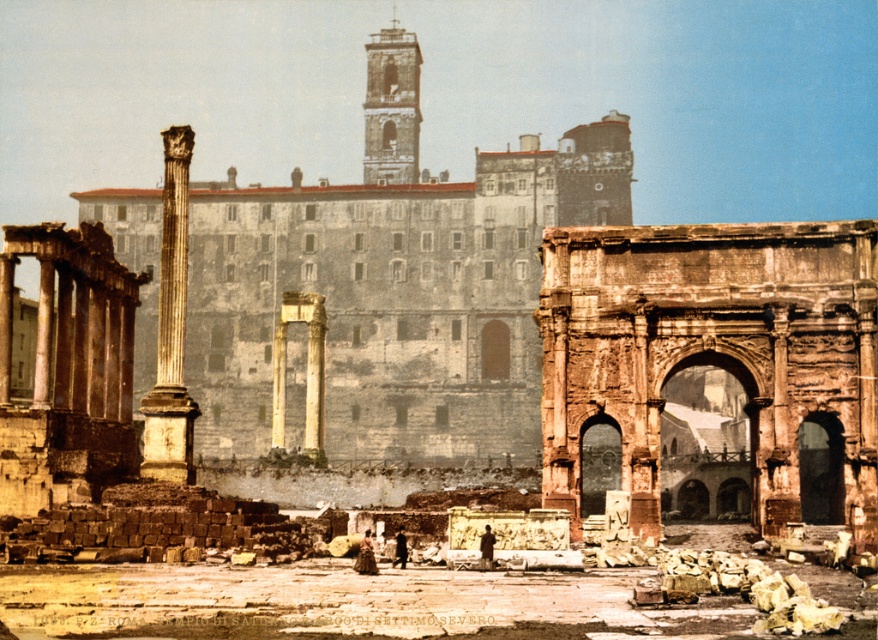
What do you see at coordinates (171, 328) in the screenshot? This screenshot has height=640, width=878. I see `yellowish stone column at left` at bounding box center [171, 328].

Is yellowish stone column at left thinner than smooth stone column at center?

Incorrect, yellowish stone column at left's width is not less than smooth stone column at center's.

At what (x,y) coordinates should I click in order to perform the action: click on yellowish stone column at left. Please return your answer as a coordinate pair (x, y). This screenshot has height=640, width=878. Looking at the image, I should click on (171, 328).

Is stone column at left wider than smooth stone column at center?

Yes, stone column at left is wider than smooth stone column at center.

The width and height of the screenshot is (878, 640). In order to click on stone column at left in this screenshot , I will do `click(394, 282)`.

You are a GUI agent. You are given a task and a screenshot of the screen. Output one action in this format:
    pyautogui.click(x=<x>, y=<y>)
    Task: Click on the stone column at left
    
    Given the screenshot: What is the action you would take?
    pyautogui.click(x=394, y=282)

Is smooth stone column at center taller than dark stone archway at center?

Yes.

Who is shorter, smooth stone column at center or dark stone archway at center?

dark stone archway at center is shorter.

Is point (317, 408) positioned in front of point (603, 476)?

No, it is not.

This screenshot has width=878, height=640. In order to click on smooth stone column at center in this screenshot , I will do `click(306, 369)`.